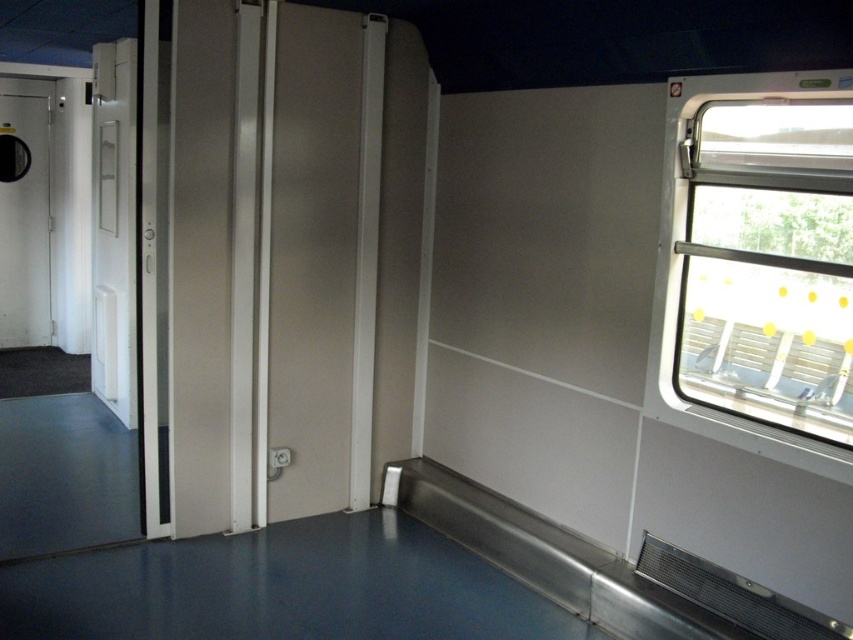
Question: Which of these objects is positioned closest to the transparent glass window at right?

Choices:
 (A) matte black door at left
 (B) white glossy door at left

Answer: (B)

Question: Among these objects, which one is farthest from the camera?

Choices:
 (A) matte black door at left
 (B) transparent glass window at right
 (C) white glossy door at left

Answer: (A)

Question: Is transparent glass window at right positioned behind matte black door at left?

Choices:
 (A) yes
 (B) no

Answer: (B)

Question: Can you confirm if transparent glass window at right is thinner than matte black door at left?

Choices:
 (A) yes
 (B) no

Answer: (B)

Question: Is transparent glass window at right above matte black door at left?

Choices:
 (A) no
 (B) yes

Answer: (A)

Question: Which point appears closest to the camera in this image?

Choices:
 (A) (699, 275)
 (B) (22, 257)
 (C) (99, 188)

Answer: (A)